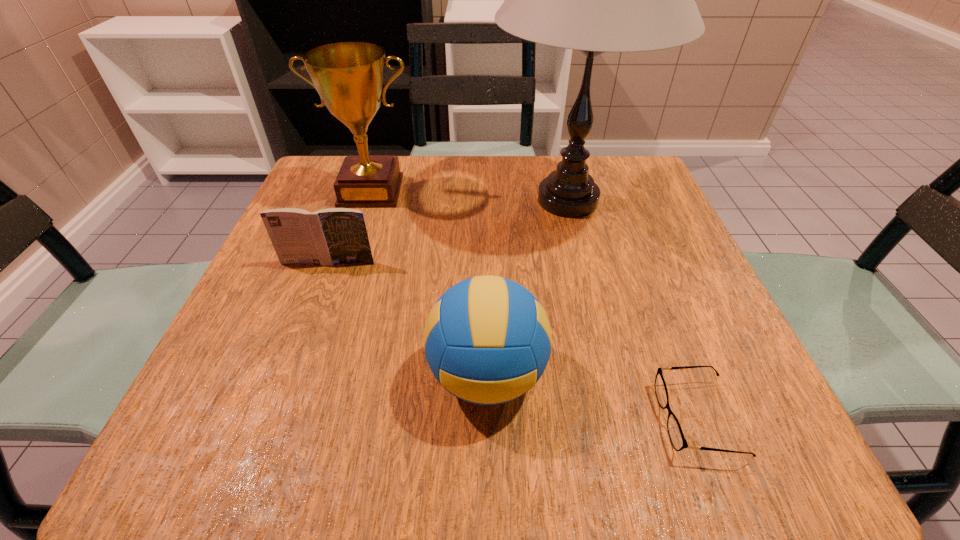
Where is `vacant area situated 0.360m on the front-facing side of the shortest object`? The width and height of the screenshot is (960, 540). vacant area situated 0.360m on the front-facing side of the shortest object is located at coordinates (402, 418).

The width and height of the screenshot is (960, 540). Identify the location of vacant space located on the front-facing side of the shortest object. (525, 418).

Locate an element on the screen. The width and height of the screenshot is (960, 540). vacant space located on the front-facing side of the shortest object is located at coordinates (568, 418).

Locate an element on the screen. lamp located at the far edge is located at coordinates (595, 0).

Where is `award at the far edge`? award at the far edge is located at coordinates (349, 77).

The image size is (960, 540). I want to click on volleyball positioned at the near edge, so click(487, 340).

Identify the location of spectacles that is positioned at the near edge. Image resolution: width=960 pixels, height=540 pixels. (678, 441).

Locate an element on the screen. award located in the left edge section of the desktop is located at coordinates (349, 77).

Find the location of a particular element. Image resolution: width=960 pixels, height=540 pixels. book positioned at the left edge is located at coordinates (326, 237).

At what (x,y) coordinates should I click in order to perform the action: click on lamp situated at the right edge. Please return your answer as a coordinate pair (x, y). Looking at the image, I should click on (595, 0).